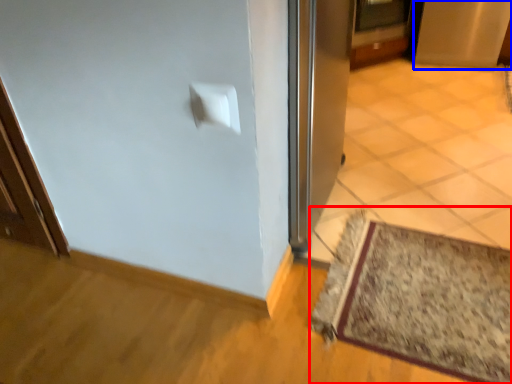
Question: Which object is further to the camera taking this photo, mat (highlighted by a red box) or screen door (highlighted by a blue box)?

Choices:
 (A) mat
 (B) screen door

Answer: (B)